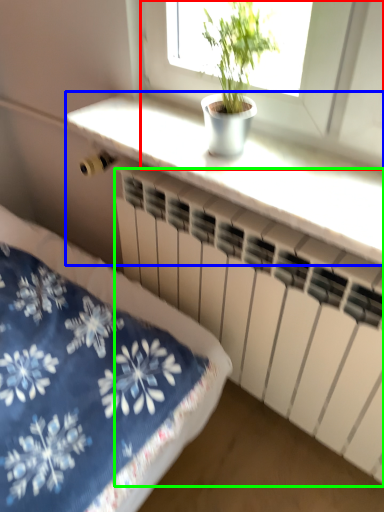
Question: Estimate the real-world distances between objects in this image. Which object is closer to window (highlighted by a red box), counter top (highlighted by a blue box) or radiator (highlighted by a green box)?

Choices:
 (A) counter top
 (B) radiator

Answer: (A)